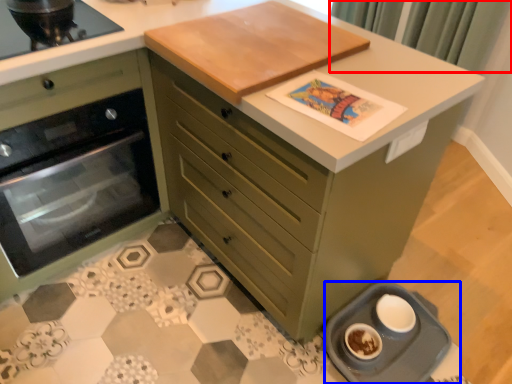
Question: Which point is further to the camera, curtain (highlighted by a red box) or appliance (highlighted by a blue box)?

Choices:
 (A) curtain
 (B) appliance

Answer: (A)